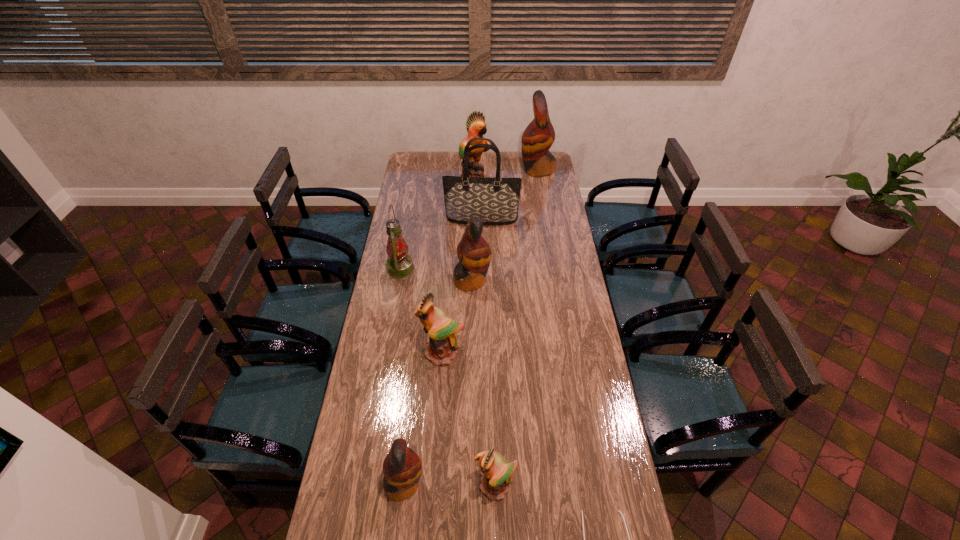
At what (x,y) coordinates should I click in order to perform the action: click on vacant region located on the front-facing side of the second biggest green parrot. Please return your answer as a coordinate pair (x, y). The height and width of the screenshot is (540, 960). Looking at the image, I should click on (440, 391).

I want to click on free space located on the back of the oil lamp, so click(x=404, y=249).

Locate an element on the screen. Image resolution: width=960 pixels, height=540 pixels. free space located 0.390m on the face of the smallest red parrot is located at coordinates (551, 484).

This screenshot has height=540, width=960. I want to click on free location located 0.060m on the front-facing side of the smallest green parrot, so click(496, 526).

The width and height of the screenshot is (960, 540). In order to click on oil lamp that is at the left edge in this screenshot , I will do `click(399, 263)`.

The width and height of the screenshot is (960, 540). In order to click on parrot that is at the left edge in this screenshot , I will do `click(402, 467)`.

At what (x,y) coordinates should I click in order to perform the action: click on object positioned at the right edge. Please return your answer as a coordinate pair (x, y). Image resolution: width=960 pixels, height=540 pixels. Looking at the image, I should click on (538, 137).

What are the coordinates of `object at the far right corner` in the screenshot? It's located at (538, 137).

The width and height of the screenshot is (960, 540). Identify the location of free space at the far edge of the desktop. (488, 164).

In the image, there is a desktop. Identify the location of free space at the left edge. (400, 218).